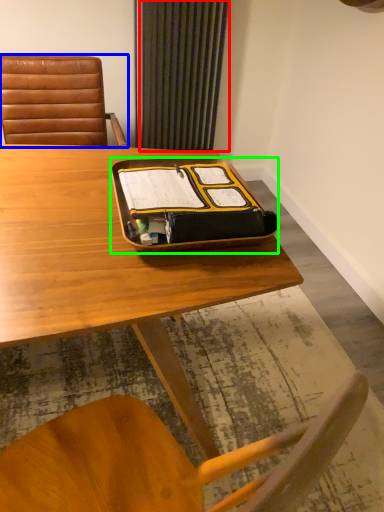
Question: Estimate the real-world distances between objects in this image. Which object is closer to curtain (highlighted by a red box), chair (highlighted by a blue box) or tray (highlighted by a green box)?

Choices:
 (A) chair
 (B) tray

Answer: (A)